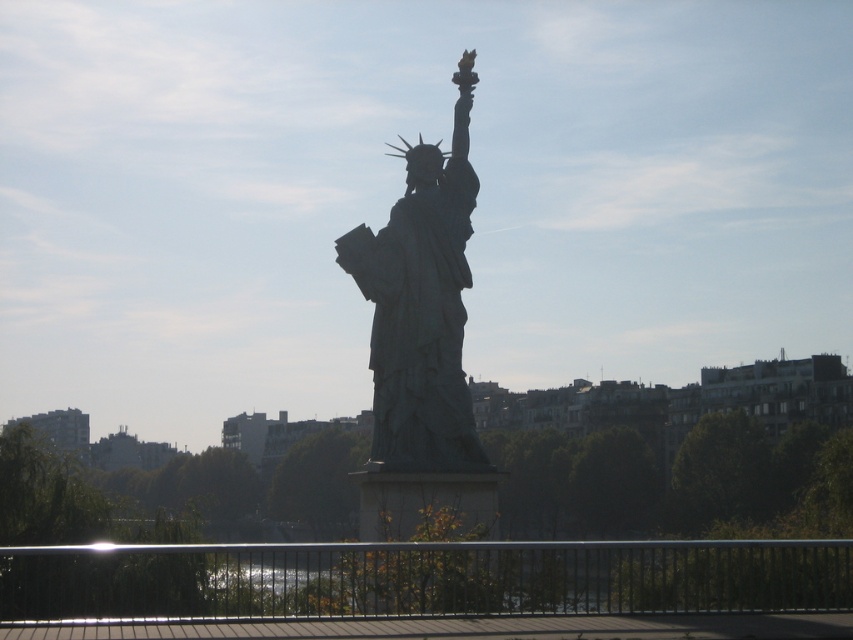
In the scene shown: You are a painter standing at the edge of the black metal railing at lower center, wanting to paint the green patina statue at center. Since you can only paint objects wider than your canvas, which is 1 meter wide, can you paint the statue?

The black metal railing at lower center is wider than the green patina statue at center. Since the statue is narrower than the railing, and the railing itself is wider than 1 meter, the statue might still be wider than 1 meter. However, without knowing the exact width of the statue, it is uncertain if it exceeds the canvas size. Therefore, it is unclear if the statue can be painted.

You are standing on a walkway and see the black metal railing at lower center and the green patina statue at center. Which object is closer to you?

The black metal railing at lower center is closer to you since it is in front of the green patina statue at center.

You are standing at the base of the Statue of Liberty and notice two points marked in the scene. The first point is at coordinates point (x=183, y=620) and the second is at point (x=430, y=250). Which of these two points is nearer to you?

Point (x=183, y=620) is closer to the viewer than point (x=430, y=250).